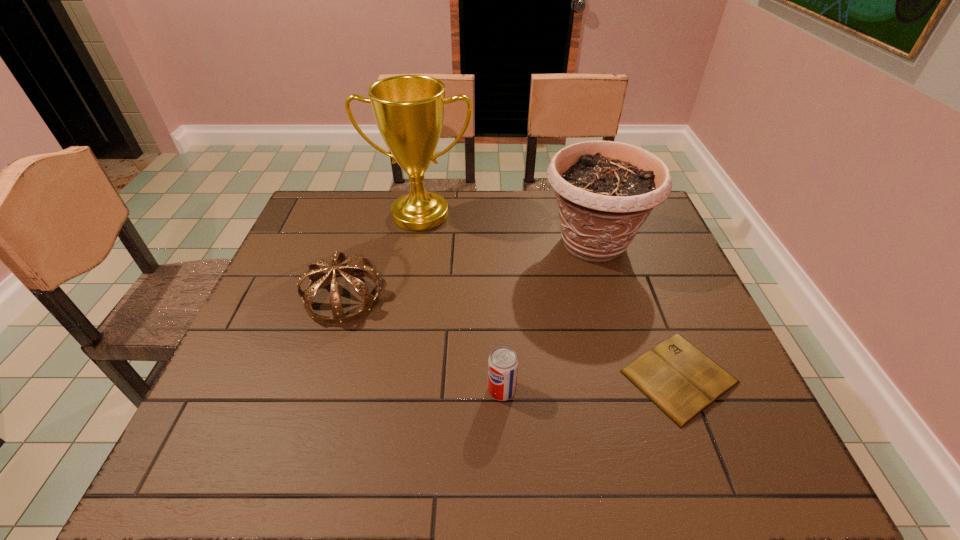
Where is `vacant space situated 0.230m on the back of the shortest object`? The width and height of the screenshot is (960, 540). vacant space situated 0.230m on the back of the shortest object is located at coordinates (637, 269).

Locate an element on the screen. The height and width of the screenshot is (540, 960). award that is positioned at the far edge is located at coordinates (409, 109).

This screenshot has width=960, height=540. Find the location of `flowerpot located at the far edge`. flowerpot located at the far edge is located at coordinates (605, 190).

Where is `object that is positioned at the left edge`? object that is positioned at the left edge is located at coordinates (317, 277).

Locate an element on the screen. The width and height of the screenshot is (960, 540). flowerpot that is at the right edge is located at coordinates (605, 190).

Image resolution: width=960 pixels, height=540 pixels. Identify the location of book at the right edge. (682, 381).

Identify the location of object at the far right corner. Image resolution: width=960 pixels, height=540 pixels. (605, 190).

In the image, there is a desktop. Identify the location of vacant region at the far edge. This screenshot has width=960, height=540. (448, 204).

Identify the location of free space at the near edge of the desktop. (344, 464).

Identify the location of vacant space at the left edge of the desktop. This screenshot has height=540, width=960. (204, 423).